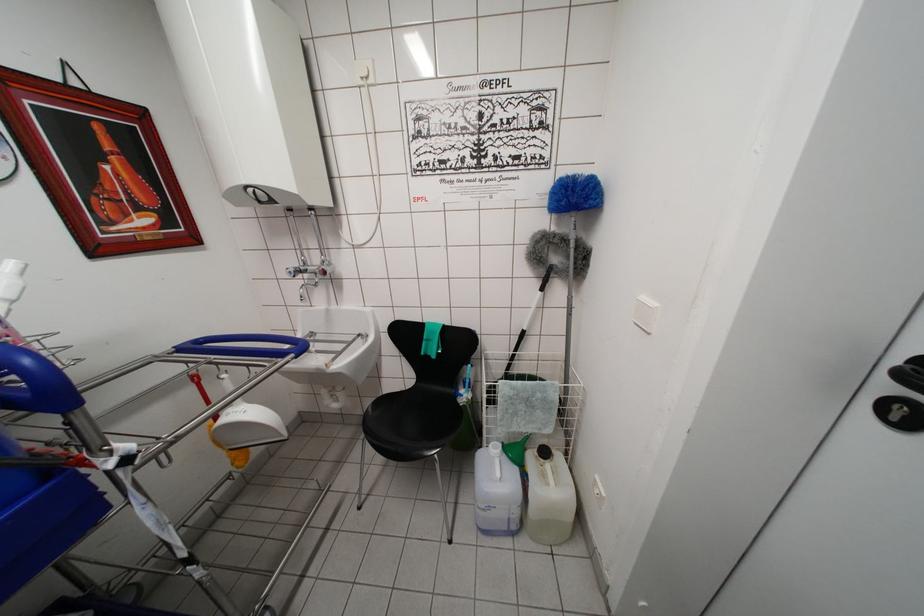
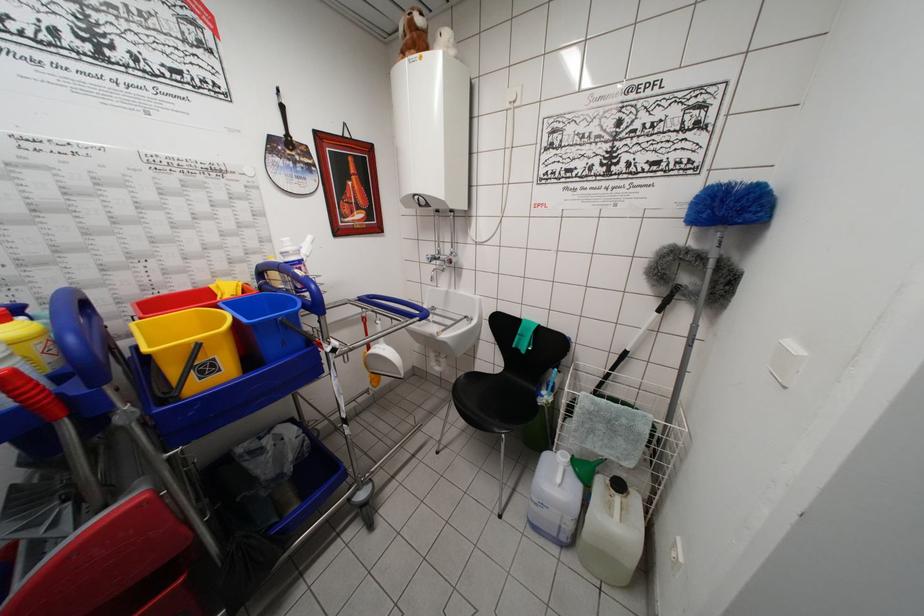
Locate, in the second image, the point that corresponds to [540,455] in the first image.

(614, 483)